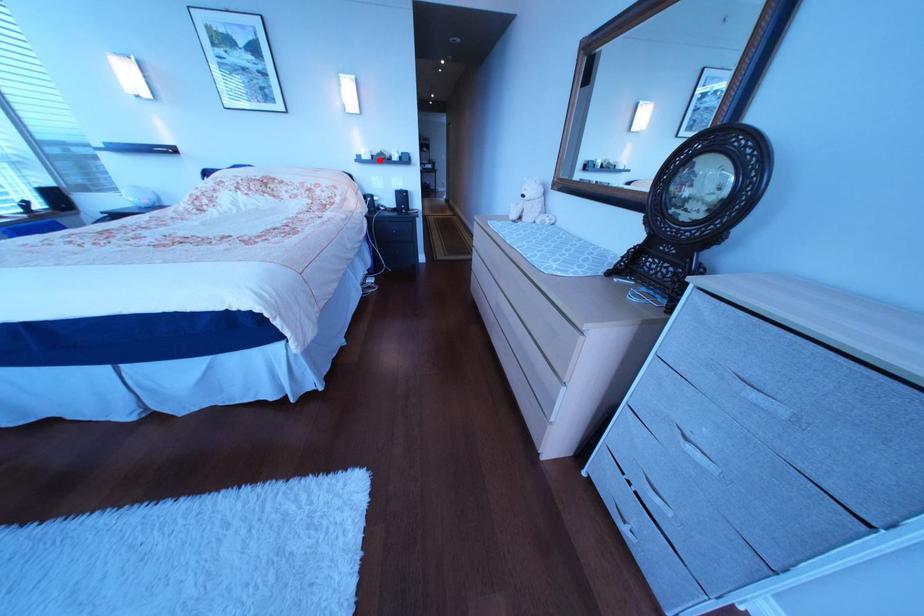
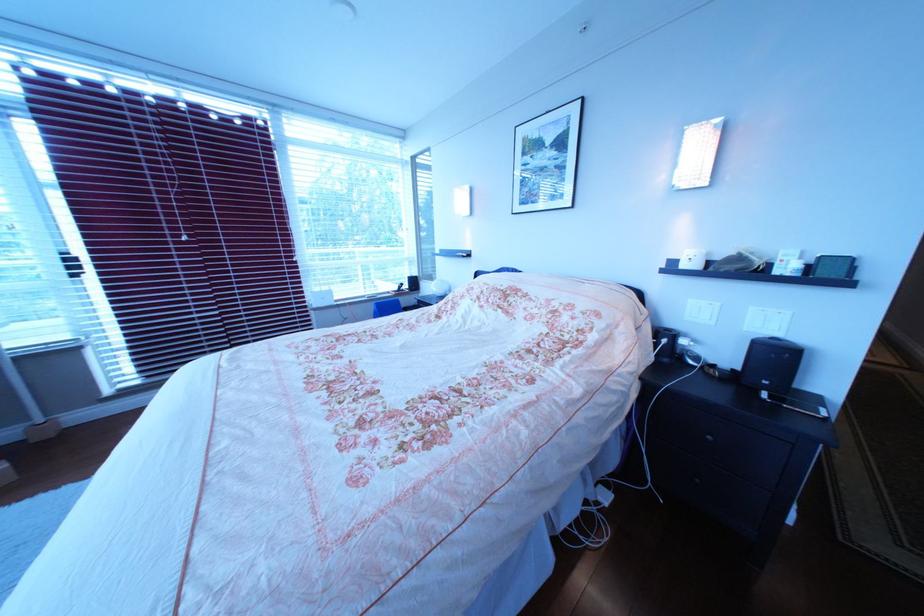
Locate, in the second image, the point that corresponds to the highlighted location in the first image.

(699, 267)